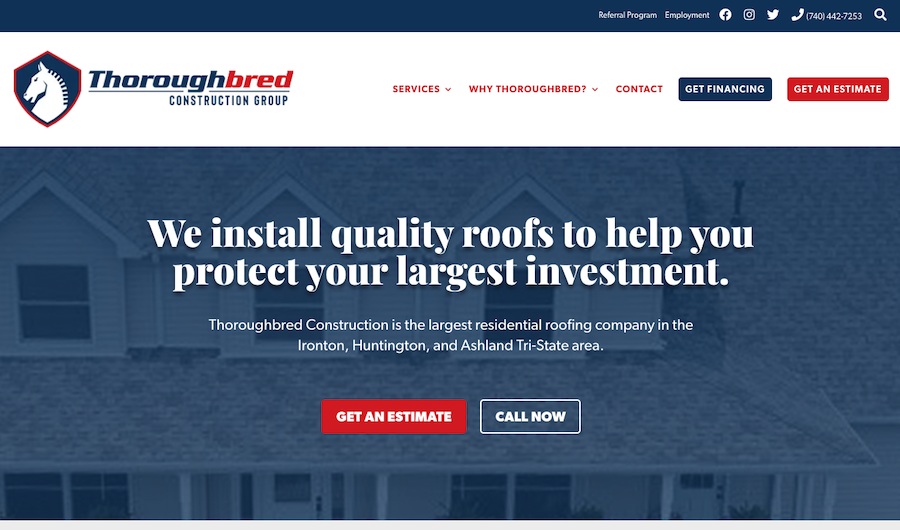
Locate an element on the screen. front door is located at coordinates (282, 504).